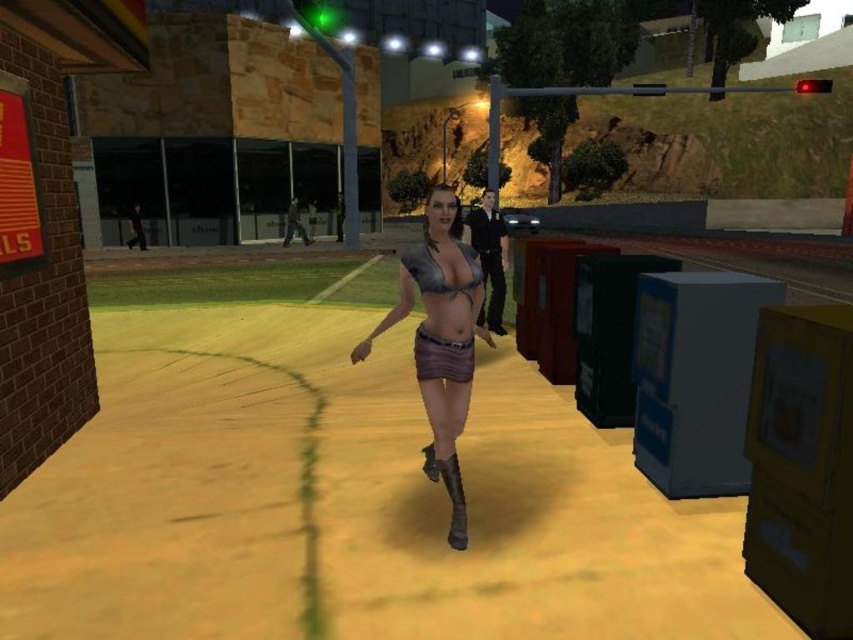
Does shiny metallic bra at center appear on the right side of brown fabric skirt at center?

In fact, shiny metallic bra at center is to the left of brown fabric skirt at center.

Which is more to the left, shiny metallic bra at center or brown fabric skirt at center?

From the viewer's perspective, shiny metallic bra at center appears more on the left side.

Where is `shiny metallic bra at center`? The height and width of the screenshot is (640, 853). shiny metallic bra at center is located at coordinates (440, 339).

Locate an element on the screen. Image resolution: width=853 pixels, height=640 pixels. shiny metallic bra at center is located at coordinates (440, 339).

Between shiny metallic bra at center and matte metallic bikini top at center, which one is positioned lower?

shiny metallic bra at center is lower down.

From the picture: Does shiny metallic bra at center appear on the right side of matte metallic bikini top at center?

Incorrect, shiny metallic bra at center is not on the right side of matte metallic bikini top at center.

The width and height of the screenshot is (853, 640). Describe the element at coordinates (440, 339) in the screenshot. I see `shiny metallic bra at center` at that location.

At what (x,y) coordinates should I click in order to perform the action: click on shiny metallic bra at center. Please return your answer as a coordinate pair (x, y). Image resolution: width=853 pixels, height=640 pixels. Looking at the image, I should click on (x=440, y=339).

Which of these two, brown fabric skirt at center or matte metallic bikini top at center, stands taller?

matte metallic bikini top at center

Can you confirm if brown fabric skirt at center is positioned above matte metallic bikini top at center?

No, brown fabric skirt at center is not above matte metallic bikini top at center.

I want to click on brown fabric skirt at center, so click(x=442, y=356).